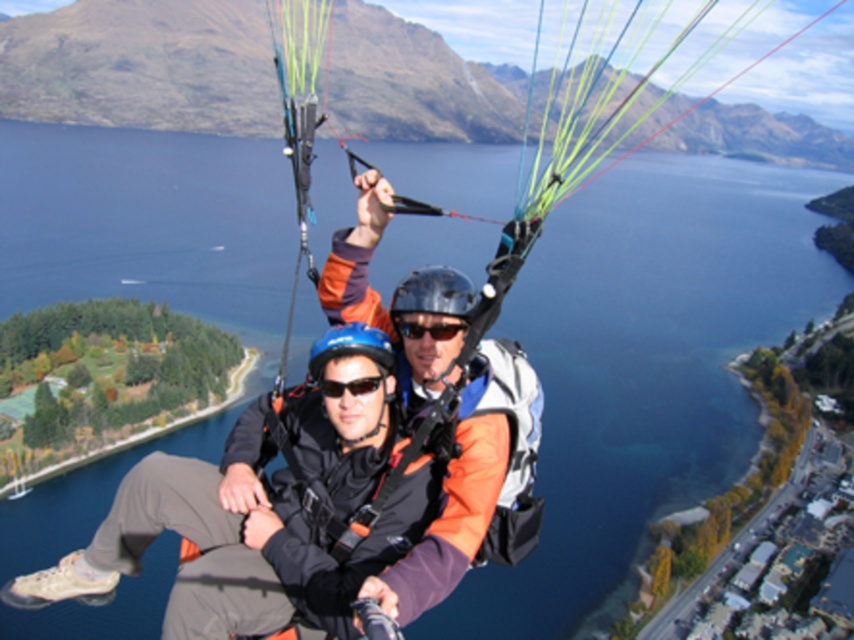
You are a photographer capturing the paragliders from below. You notice the orange fabric jacket at center and the black matte goggles at center. Which object should you zoom in on to get a clearer image of the person?

The orange fabric jacket at center is larger in size than the black matte goggles at center, so zooming in on the orange fabric jacket at center would provide a clearer image of the person since it is larger and more visible.

You are a photographer capturing the paragliding scene. You notice the orange fabric jacket at center and the black matte sunglasses at center. Which object is positioned more to the left in the image?

The orange fabric jacket at center is positioned to the left of the black matte sunglasses at center.